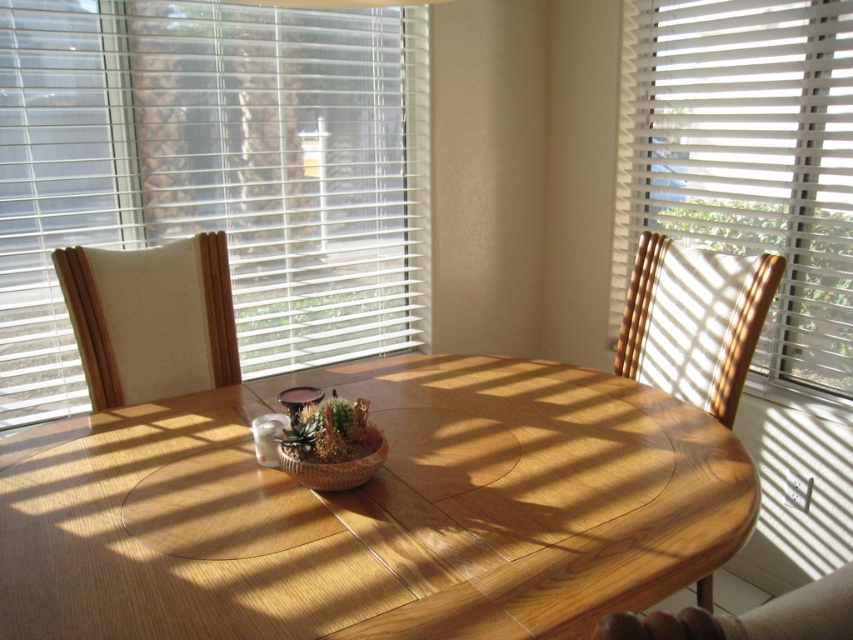
You are standing in the room and want to locate the point at coordinates point (213, 176). Based on the scene description, where would this point be located?

The point (213, 176) is on white blinds at upper left.

You are standing in the room and want to move from the point at coordinates point (x=132, y=193) to the point at coordinates point (x=189, y=365). Can you walk directly between them without any obstacles?

Point (x=132, y=193) is behind point (x=189, y=365), so you cannot walk directly between them without passing through the point (x=189, y=365) first.

You are sitting at the light brown wood table at center and want to look out the window. Which direction should you turn to face the white blinds at upper left?

Since the light brown wood table at center is positioned on the right side of the white blinds at upper left, you should turn to your left to face the white blinds at upper left.